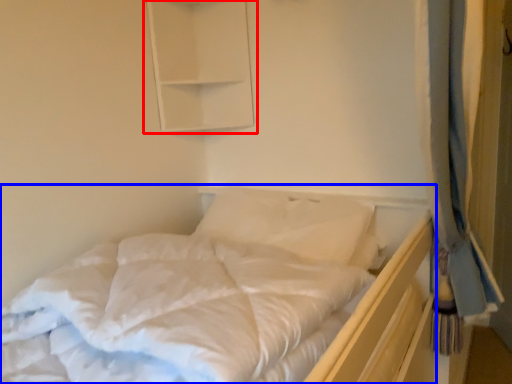
Question: Which object appears farthest to the camera in this image, medicine cabinet (highlighted by a red box) or bed (highlighted by a blue box)?

Choices:
 (A) medicine cabinet
 (B) bed

Answer: (A)